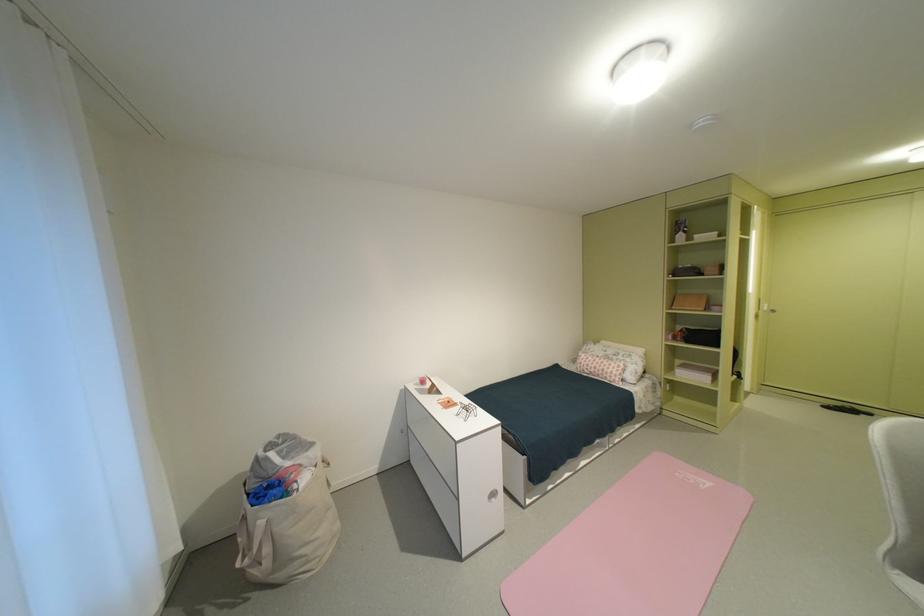
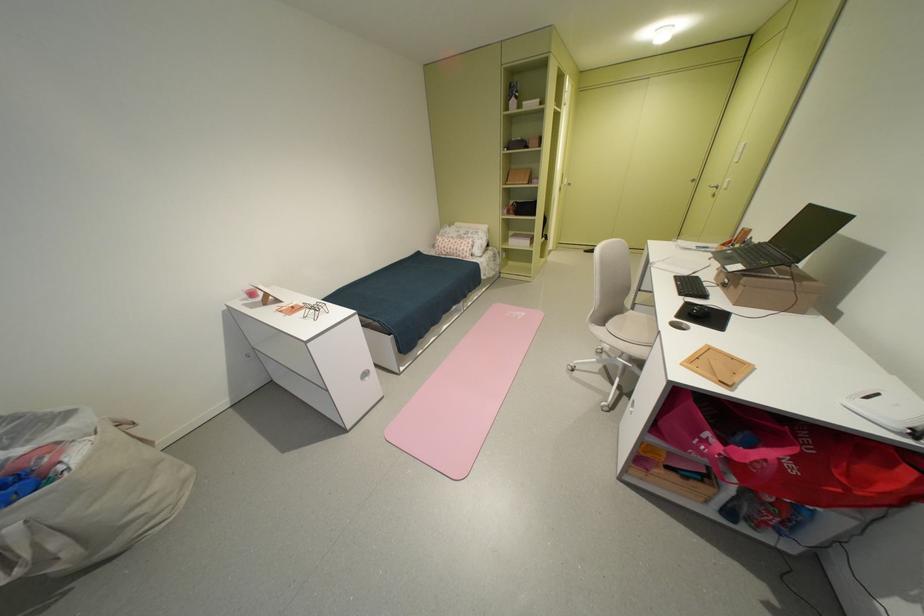
Where in the second image is the point corresponding to point 713,485 from the first image?

(530, 315)